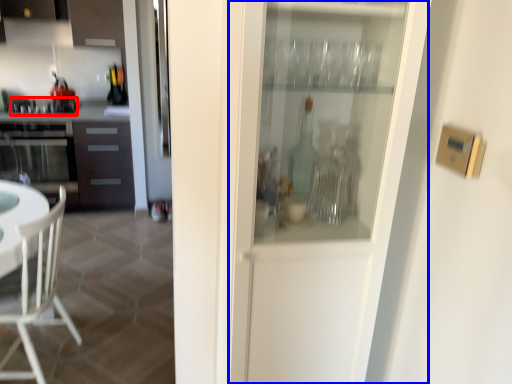
Question: Which point is further to the camera, appliance (highlighted by a red box) or screen door (highlighted by a blue box)?

Choices:
 (A) appliance
 (B) screen door

Answer: (A)